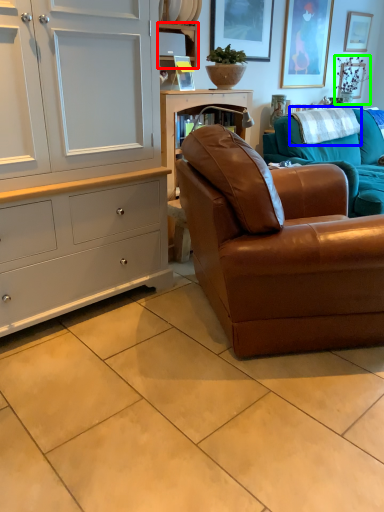
Question: Considering the real-world distances, which object is closest to shelf (highlighted by a red box)? blanket (highlighted by a blue box) or plant (highlighted by a green box).

Choices:
 (A) blanket
 (B) plant

Answer: (A)